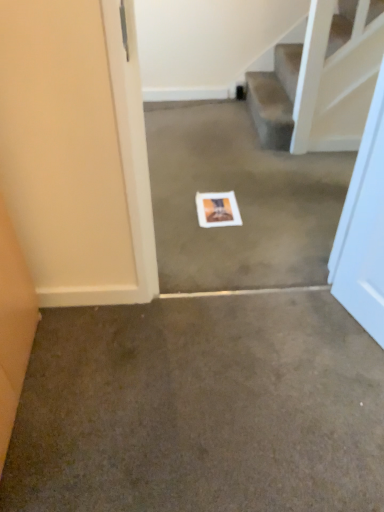
Question: Is brown carpet at center, the 1th concrete viewed from the front, inside the boundaries of white paper at center, the second concrete when ordered from front to back, or outside?

Choices:
 (A) outside
 (B) inside

Answer: (A)

Question: Is brown carpet at center, the 1th concrete viewed from the front, in front of or behind white paper at center, positioned as the first concrete in back-to-front order, in the image?

Choices:
 (A) behind
 (B) front

Answer: (B)

Question: Which object is positioned farthest from the white paper at center, the second concrete when ordered from front to back?

Choices:
 (A) white matte postcard at center
 (B) brown carpet at center, the 1th concrete viewed from the front

Answer: (B)

Question: Which of these objects is positioned farthest from the brown carpet at center, the 1th concrete from the bottom?

Choices:
 (A) white matte postcard at center
 (B) white paper at center, the 2th concrete ordered from the bottom

Answer: (A)